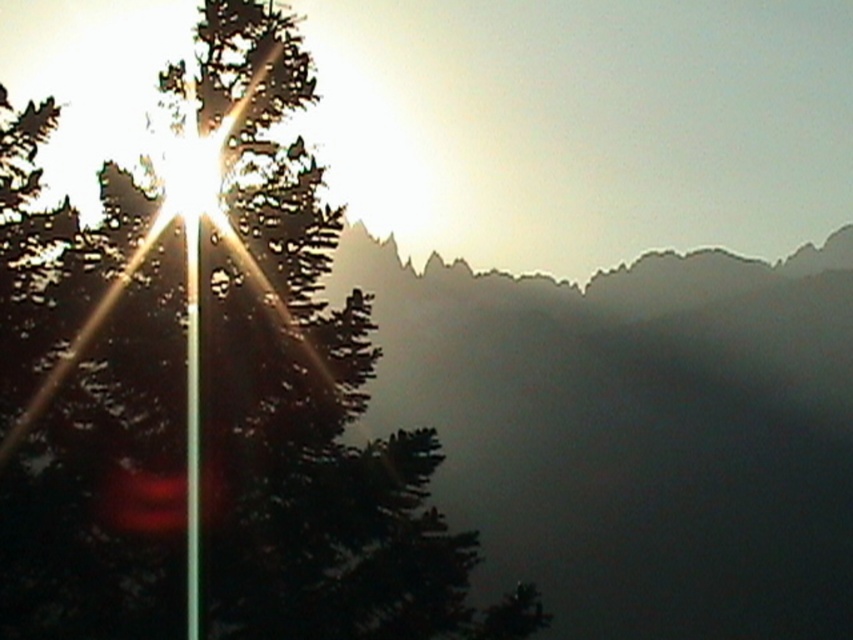
You are a photographer setting up a tripod to capture the sunrise. You have a green matte tree at upper left and a metallic pole at left in the scene. To ensure both are in frame, what is the minimum distance your camera needs to be from both objects?

The minimum distance your camera needs to be from both the green matte tree at upper left and the metallic pole at left is 7.09 feet, as they are 7.09 feet apart.

You are a photographer setting up equipment in this scene. You have a green matte tree at upper left and a metallic pole at left in your viewfinder. Which object will appear larger in your photo?

The green matte tree at upper left will appear larger in the photo since it is bigger than the metallic pole at left according to the description.

You are a photographer setting up equipment in the scene. You have a green matte tree at upper left and a metallic pole at left in your viewfinder. Which object is positioned higher in the frame?

The green matte tree at upper left is positioned higher in the frame than the metallic pole at left.